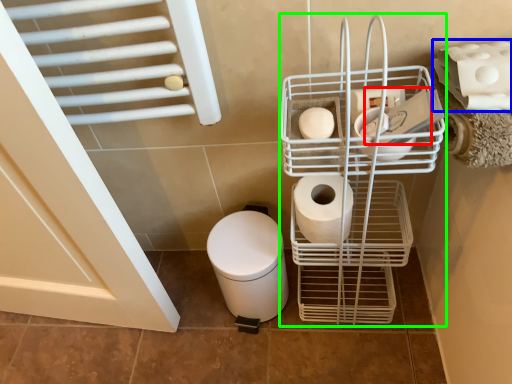
Question: Which object is the closest to the toilet paper (highlighted by a red box)? Choose among these: toilet paper (highlighted by a blue box) or shopping cart (highlighted by a green box).

Choices:
 (A) toilet paper
 (B) shopping cart

Answer: (A)